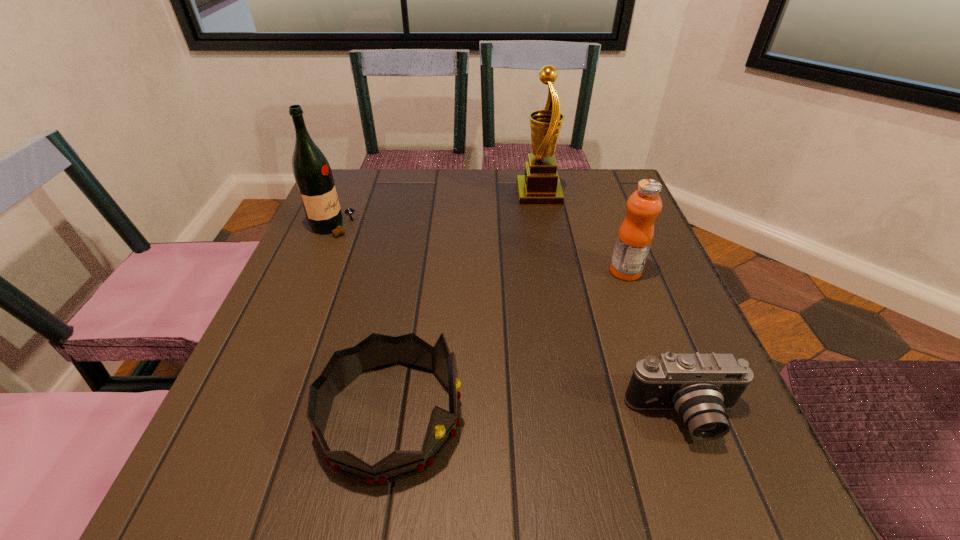
What are the coordinates of `blank space located 0.200m on the front-facing side of the third object from right to left` in the screenshot? It's located at (442, 194).

Locate an element on the screen. free point located 0.090m on the front-facing side of the third object from right to left is located at coordinates (483, 194).

Locate an element on the screen. This screenshot has width=960, height=540. free space located on the right of the wine bottle is located at coordinates (495, 226).

The width and height of the screenshot is (960, 540). In order to click on free location located 0.060m on the left of the third tallest object in this screenshot , I will do `click(581, 271)`.

Where is `vacant position located 0.210m at the front of the fourth tallest object with jewels`? The image size is (960, 540). vacant position located 0.210m at the front of the fourth tallest object with jewels is located at coordinates (599, 417).

Image resolution: width=960 pixels, height=540 pixels. Find the location of `free space located 0.090m on the front-facing side of the camera`. free space located 0.090m on the front-facing side of the camera is located at coordinates (721, 513).

Locate an element on the screen. This screenshot has height=540, width=960. award that is at the far edge is located at coordinates (540, 186).

You are a GUI agent. You are given a task and a screenshot of the screen. Output one action in this format:
    pyautogui.click(x=<x>, y=<y>)
    Task: Click on the wine bottle positioned at the far edge
    This screenshot has width=960, height=540.
    Given the screenshot: What is the action you would take?
    pyautogui.click(x=311, y=170)

At what (x,y) coordinates should I click in order to perform the action: click on object that is positioned at the near edge. Please return your answer as a coordinate pair (x, y). This screenshot has height=540, width=960. Looking at the image, I should click on (376, 351).

You are a GUI agent. You are given a task and a screenshot of the screen. Output one action in this format:
    pyautogui.click(x=<x>, y=<y>)
    Task: Click on the wine bottle present at the left edge
    The width and height of the screenshot is (960, 540).
    Given the screenshot: What is the action you would take?
    pyautogui.click(x=311, y=170)